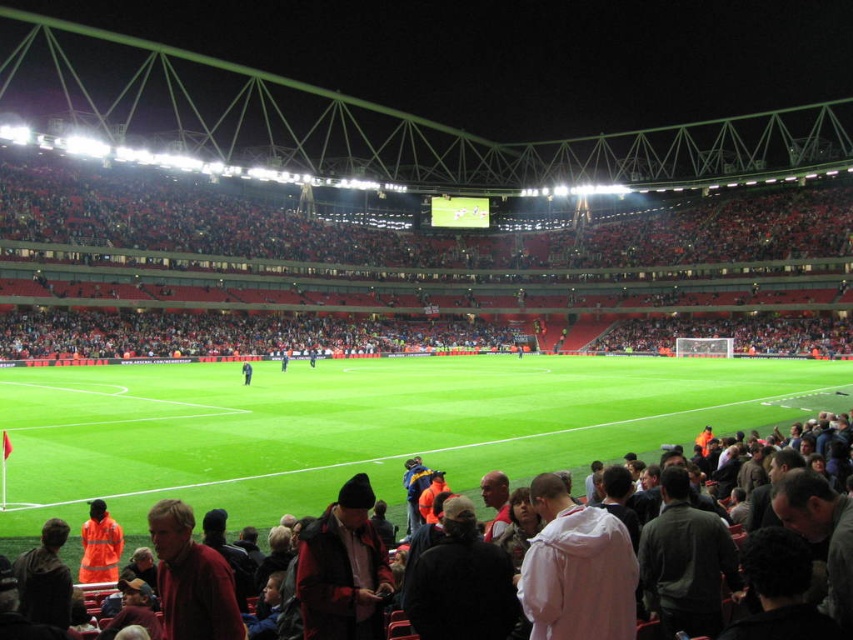
Question: Estimate the real-world distances between objects in this image. Which object is farther from the orange raincoat at lower left?

Choices:
 (A) dark gray jacket at lower center
 (B) dark blue jacket at center
 (C) green grass at center

Answer: (B)

Question: Which point is closer to the camera taking this photo?

Choices:
 (A) (229, 205)
 (B) (103, 538)
 (C) (67, 440)
 (D) (819, 426)

Answer: (B)

Question: Does red plastic seats at upper center lie in front of dark blue jacket at center?

Choices:
 (A) yes
 (B) no

Answer: (B)

Question: Is green grass at center thinner than orange raincoat at lower left?

Choices:
 (A) no
 (B) yes

Answer: (A)

Question: Can you confirm if green grass at center is positioned above dark gray jacket at lower center?

Choices:
 (A) no
 (B) yes

Answer: (B)

Question: Among these points, which one is nearest to the camera?

Choices:
 (A) (248, 365)
 (B) (737, 204)

Answer: (A)